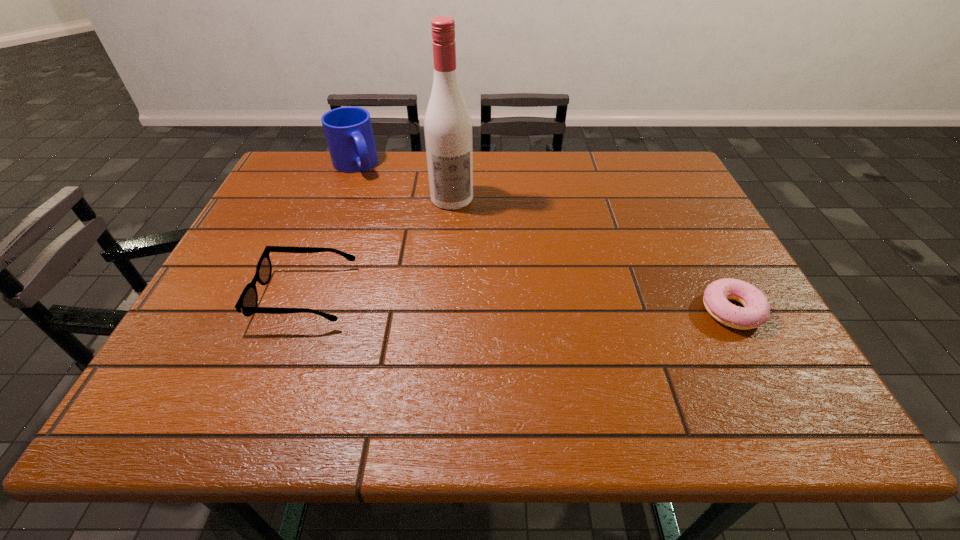
The image size is (960, 540). What are the coordinates of `vacant space on the desktop that is between the spectacles and the rightmost object and is positioned on the label of the tallest object` in the screenshot? It's located at (471, 301).

You are a GUI agent. You are given a task and a screenshot of the screen. Output one action in this format:
    pyautogui.click(x=<x>, y=<y>)
    Task: Click on the free space on the desktop that is between the second shortest object and the doughnut and is positioned on the side with the handle of the mug
    This screenshot has height=540, width=960.
    Given the screenshot: What is the action you would take?
    pyautogui.click(x=453, y=300)